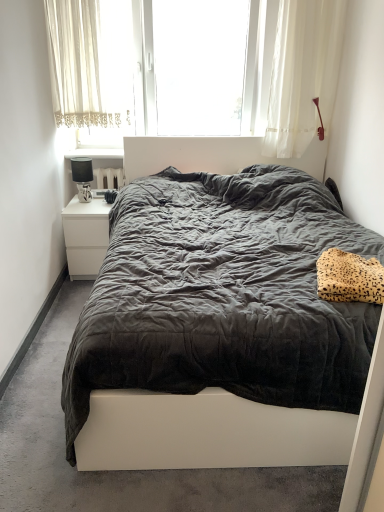
Question: Does white sheer curtain at upper center have a smaller size compared to white sheer curtain at upper left?

Choices:
 (A) yes
 (B) no

Answer: (B)

Question: Is white sheer curtain at upper center wider than white sheer curtain at upper left?

Choices:
 (A) no
 (B) yes

Answer: (B)

Question: Are white sheer curtain at upper center and white sheer curtain at upper left far apart?

Choices:
 (A) no
 (B) yes

Answer: (A)

Question: Considering the relative positions of white sheer curtain at upper center and white sheer curtain at upper left in the image provided, is white sheer curtain at upper center to the left of white sheer curtain at upper left from the viewer's perspective?

Choices:
 (A) yes
 (B) no

Answer: (B)

Question: Can you confirm if white sheer curtain at upper center is bigger than white sheer curtain at upper left?

Choices:
 (A) no
 (B) yes

Answer: (B)

Question: From the image's perspective, would you say white sheer curtain at upper center is shown under white sheer curtain at upper left?

Choices:
 (A) yes
 (B) no

Answer: (B)

Question: From a real-world perspective, is white sheer curtain at upper center positioned over white glossy nightstand at upper left based on gravity?

Choices:
 (A) yes
 (B) no

Answer: (A)

Question: Can white glossy nightstand at upper left be found inside white sheer curtain at upper center?

Choices:
 (A) no
 (B) yes

Answer: (A)

Question: Considering the relative sizes of white sheer curtain at upper center and white glossy nightstand at upper left in the image provided, is white sheer curtain at upper center shorter than white glossy nightstand at upper left?

Choices:
 (A) yes
 (B) no

Answer: (B)

Question: Does white sheer curtain at upper center appear on the right side of white glossy nightstand at upper left?

Choices:
 (A) yes
 (B) no

Answer: (A)

Question: Could you tell me if white sheer curtain at upper center is turned towards white glossy nightstand at upper left?

Choices:
 (A) yes
 (B) no

Answer: (B)

Question: Is white sheer curtain at upper center outside white glossy nightstand at upper left?

Choices:
 (A) no
 (B) yes

Answer: (B)

Question: From the image's perspective, is white glossy nightstand at left above white sheer curtain at upper center?

Choices:
 (A) no
 (B) yes

Answer: (A)